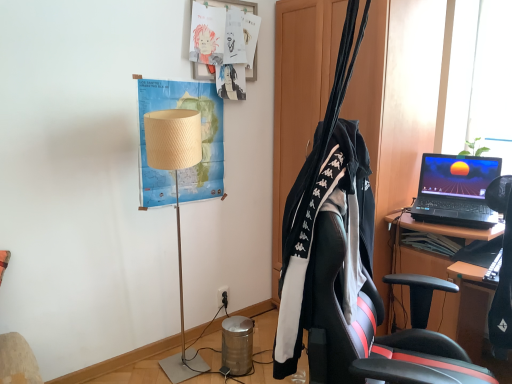
Question: Considering the positions of matte paper posters at upper center, which is the 1th poster in top-to-bottom order, and beige paper map at upper left, which ranks as the 2th poster in top-to-bottom order, in the image, is matte paper posters at upper center, which is the 1th poster in top-to-bottom order, taller or shorter than beige paper map at upper left, which ranks as the 2th poster in top-to-bottom order,?

Choices:
 (A) tall
 (B) short

Answer: (B)

Question: From a real-world perspective, is matte paper posters at upper center, the second poster when ordered from bottom to top, above or below beige paper map at upper left, which ranks as the 2th poster in top-to-bottom order?

Choices:
 (A) below
 (B) above

Answer: (B)

Question: Estimate the real-world distances between objects in this image. Which object is farther from the black plastic power outlet at lower center?

Choices:
 (A) black fabric clothesline at center
 (B) matte paper posters at upper center, the second poster when ordered from bottom to top
 (C) beige paper map at upper left, the first poster in the bottom-to-top sequence
 (D) beige fabric lampshade at center-left

Answer: (B)

Question: Estimate the real-world distances between objects in this image. Which object is farther from the beige paper map at upper left, the first poster in the bottom-to-top sequence?

Choices:
 (A) black fabric clothesline at center
 (B) matte paper posters at upper center, which is the 1th poster in top-to-bottom order
 (C) beige fabric lampshade at center-left
 (D) black plastic power outlet at lower center

Answer: (A)